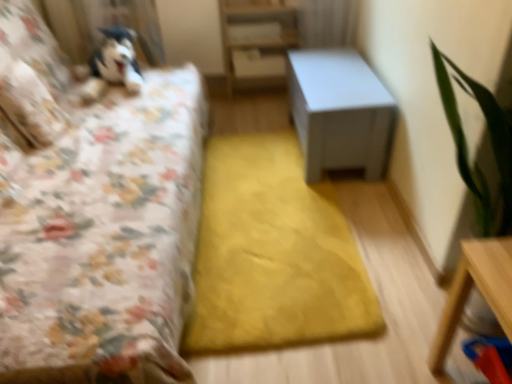
Question: Visually, is white matte table at center, the 2th table from the front, positioned to the left or to the right of floral fabric pillow at left, the 2th pillow from the left?

Choices:
 (A) left
 (B) right

Answer: (B)

Question: Relative to floral fabric pillow at left, the 2th pillow from the left, is white matte table at center, positioned as the first table in top-to-bottom order, in front or behind?

Choices:
 (A) behind
 (B) front

Answer: (A)

Question: Which object is positioned closest to the wooden table at lower right, the second table from the back?

Choices:
 (A) white matte bookshelf at center
 (B) floral fabric bed at left
 (C) floral fabric pillow at left, which ranks as the second pillow in back-to-front order
 (D) fluffy white pillow at upper left, the 1th pillow from the back
 (E) white matte table at center, the 2th table from the front

Answer: (E)

Question: Estimate the real-world distances between objects in this image. Which object is farther from the floral fabric bed at left?

Choices:
 (A) floral fabric pillow at left, arranged as the first pillow when ordered from the bottom
 (B) wooden table at lower right, positioned as the first table in bottom-to-top order
 (C) white matte table at center, the 2th table from the front
 (D) white matte bookshelf at center
 (E) fluffy white pillow at upper left, which ranks as the 2th pillow in front-to-back order

Answer: (B)